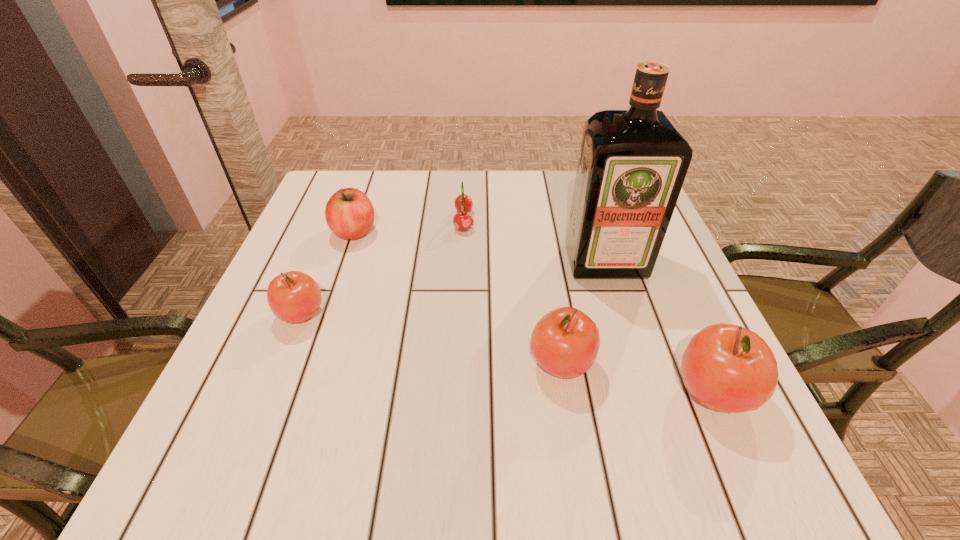
If the aim is uniform spacing by inserting an additional apple among them, please point to a vacant space for this new apple. Please provide its 2D coordinates. Your answer should be formatted as a tuple, i.e. [(x, y)], where the tuple contains the x and y coordinates of a point satisfying the conditions above.

[(424, 338)]